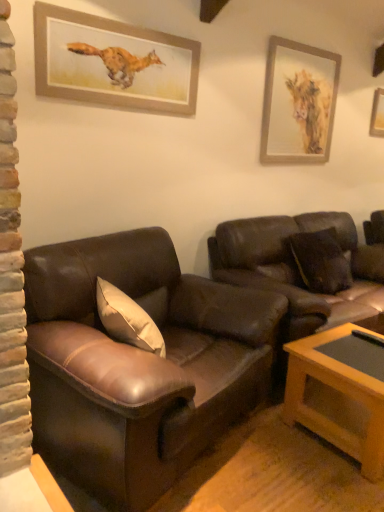
What do you see at coordinates (377, 114) in the screenshot? The height and width of the screenshot is (512, 384). I see `wooden picture frame at upper right, the 3th picture frame in the left-to-right sequence` at bounding box center [377, 114].

This screenshot has width=384, height=512. Find the location of `matte gold picture frame at upper right, which is the 2th picture frame from front to back`. matte gold picture frame at upper right, which is the 2th picture frame from front to back is located at coordinates (298, 102).

The height and width of the screenshot is (512, 384). What do you see at coordinates (340, 393) in the screenshot?
I see `wooden coffee table at lower right` at bounding box center [340, 393].

You are a GUI agent. You are given a task and a screenshot of the screen. Output one action in this format:
    pyautogui.click(x=<x>, y=<y>)
    Task: Click on the brown leather couch at left, which is the first studio couch in left-to-right order
    This screenshot has height=512, width=384.
    Given the screenshot: What is the action you would take?
    pyautogui.click(x=139, y=364)

Where is `brown leather couch at center, the first studio couch viewed from the right`? Image resolution: width=384 pixels, height=512 pixels. brown leather couch at center, the first studio couch viewed from the right is located at coordinates (297, 269).

Which of these two, wooden picture frame at upper right, the 3th picture frame in the left-to-right sequence, or matte gold picture frame at upper right, positioned as the second picture frame in right-to-left order, stands taller?

Standing taller between the two is matte gold picture frame at upper right, positioned as the second picture frame in right-to-left order.

Is matte gold picture frame at upper right, positioned as the second picture frame in right-to-left order, at the back of wooden picture frame at upper right, the 3th picture frame in the left-to-right sequence?

No.

Relative to matte gold picture frame at upper right, positioned as the second picture frame in right-to-left order, is wooden picture frame at upper right, the 3th picture frame in the left-to-right sequence, in front or behind?

In the image, wooden picture frame at upper right, the 3th picture frame in the left-to-right sequence, appears behind matte gold picture frame at upper right, positioned as the second picture frame in right-to-left order.

How much distance is there between wooden picture frame at upper right, which is the 1th picture frame from right to left, and matte gold picture frame at upper right, the 2th picture frame from the left?

The distance of wooden picture frame at upper right, which is the 1th picture frame from right to left, from matte gold picture frame at upper right, the 2th picture frame from the left, is 3.63 feet.

Can you see wooden picture frame at upper right, which appears as the third picture frame when viewed from the front, touching brown leather couch at center, acting as the second studio couch starting from the left?

No, wooden picture frame at upper right, which appears as the third picture frame when viewed from the front, is not making contact with brown leather couch at center, acting as the second studio couch starting from the left.

Is wooden picture frame at upper right, the 3th picture frame in the left-to-right sequence, inside or outside of brown leather couch at center, the first studio couch viewed from the right?

wooden picture frame at upper right, the 3th picture frame in the left-to-right sequence, exists outside the volume of brown leather couch at center, the first studio couch viewed from the right.

From the image's perspective, does wooden picture frame at upper right, which appears as the third picture frame when viewed from the front, appear lower than brown leather couch at center, the first studio couch viewed from the right?

Incorrect, from the image's perspective, wooden picture frame at upper right, which appears as the third picture frame when viewed from the front, is higher than brown leather couch at center, the first studio couch viewed from the right.

Considering the positions of objects matte gold picture frame at upper right, positioned as the 2th picture frame in back-to-front order, and brown leather couch at center, the first studio couch viewed from the right, in the image provided, who is more to the right, matte gold picture frame at upper right, positioned as the 2th picture frame in back-to-front order, or brown leather couch at center, the first studio couch viewed from the right,?

brown leather couch at center, the first studio couch viewed from the right.

From a real-world perspective, is matte gold picture frame at upper right, positioned as the second picture frame in right-to-left order, on brown leather couch at center, acting as the second studio couch starting from the left?

Indeed, from a real-world perspective, matte gold picture frame at upper right, positioned as the second picture frame in right-to-left order, stands above brown leather couch at center, acting as the second studio couch starting from the left.

Is point (278, 113) farther from viewer compared to point (342, 295)?

Yes, point (278, 113) is behind point (342, 295).

From the image's perspective, between matte gold picture frame at upper right, the 2th picture frame from the left, and brown leather couch at center, acting as the second studio couch starting from the left, who is located below?

brown leather couch at center, acting as the second studio couch starting from the left, from the image's perspective.

Considering the relative sizes of brown leather couch at center, the first studio couch viewed from the right, and wooden picture frame at upper right, the 3th picture frame in the left-to-right sequence, in the image provided, is brown leather couch at center, the first studio couch viewed from the right, shorter than wooden picture frame at upper right, the 3th picture frame in the left-to-right sequence,?

Incorrect, the height of brown leather couch at center, the first studio couch viewed from the right, does not fall short of that of wooden picture frame at upper right, the 3th picture frame in the left-to-right sequence.

Considering the sizes of objects brown leather couch at center, the first studio couch viewed from the right, and wooden picture frame at upper right, the 3th picture frame in the left-to-right sequence, in the image provided, who is bigger, brown leather couch at center, the first studio couch viewed from the right, or wooden picture frame at upper right, the 3th picture frame in the left-to-right sequence,?

brown leather couch at center, the first studio couch viewed from the right.

Is brown leather couch at center, the first studio couch viewed from the right, located outside wooden picture frame at upper right, the 3th picture frame in the left-to-right sequence?

brown leather couch at center, the first studio couch viewed from the right, is positioned outside wooden picture frame at upper right, the 3th picture frame in the left-to-right sequence.

Is brown leather couch at left, arranged as the second studio couch when viewed from the right, surrounded by matte gold picture frame at upper right, the 2th picture frame from the left?

No, brown leather couch at left, arranged as the second studio couch when viewed from the right, is not a part of matte gold picture frame at upper right, the 2th picture frame from the left.

Does point (315, 152) come behind point (54, 410)?

Yes, point (315, 152) is behind point (54, 410).

Can you tell me how much matte gold picture frame at upper right, which is the 2th picture frame from front to back, and brown leather couch at left, arranged as the second studio couch when viewed from the right, differ in facing direction?

15.5 degrees separate the facing orientations of matte gold picture frame at upper right, which is the 2th picture frame from front to back, and brown leather couch at left, arranged as the second studio couch when viewed from the right.

Looking at their sizes, would you say matte gold picture frame at upper right, positioned as the 2th picture frame in back-to-front order, is wider or thinner than brown leather couch at left, which is the first studio couch in left-to-right order?

In the image, matte gold picture frame at upper right, positioned as the 2th picture frame in back-to-front order, appears to be more narrow than brown leather couch at left, which is the first studio couch in left-to-right order.

Between matte gold picture frame at upper right, positioned as the second picture frame in right-to-left order, and wooden picture frame at upper left, acting as the first picture frame starting from the left, which one is positioned behind?

matte gold picture frame at upper right, positioned as the second picture frame in right-to-left order, is further away from the camera.

At what (x,y) coordinates should I click in order to perform the action: click on picture frame that is the 1st one when counting upward from the wooden picture frame at upper left, acting as the first picture frame starting from the left (from the image's perspective). Please return your answer as a coordinate pair (x, y). This screenshot has height=512, width=384. Looking at the image, I should click on (298, 102).

Is matte gold picture frame at upper right, positioned as the second picture frame in right-to-left order, oriented away from wooden picture frame at upper left, which ranks as the 1th picture frame in front-to-back order?

No, wooden picture frame at upper left, which ranks as the 1th picture frame in front-to-back order, is not at the back of matte gold picture frame at upper right, positioned as the second picture frame in right-to-left order.

Is there a large distance between matte gold picture frame at upper right, the 2th picture frame from the left, and wooden picture frame at upper left, the 3th picture frame in the right-to-left sequence?

Yes.

Could matte gold picture frame at upper right, the 2th picture frame from the left, be considered to be inside brown leather couch at center, the first studio couch viewed from the right?

No, matte gold picture frame at upper right, the 2th picture frame from the left, is not surrounded by brown leather couch at center, the first studio couch viewed from the right.

Which object is positioned more to the left, brown leather couch at center, acting as the second studio couch starting from the left, or matte gold picture frame at upper right, which is the 2th picture frame from front to back?

matte gold picture frame at upper right, which is the 2th picture frame from front to back.

How many degrees apart are the facing directions of brown leather couch at center, acting as the second studio couch starting from the left, and matte gold picture frame at upper right, which is the 2th picture frame from front to back?

The angle between the facing direction of brown leather couch at center, acting as the second studio couch starting from the left, and the facing direction of matte gold picture frame at upper right, which is the 2th picture frame from front to back, is 0.00284 degrees.

From a real-world perspective, is brown leather couch at center, acting as the second studio couch starting from the left, below matte gold picture frame at upper right, positioned as the second picture frame in right-to-left order?

Yes, from a real-world perspective, brown leather couch at center, acting as the second studio couch starting from the left, is beneath matte gold picture frame at upper right, positioned as the second picture frame in right-to-left order.

This screenshot has height=512, width=384. In order to click on picture frame on the right of the matte gold picture frame at upper right, the 2th picture frame from the left in this screenshot , I will do `click(377, 114)`.

Identify the location of picture frame that is the 2nd one when counting backward from the brown leather couch at center, the first studio couch viewed from the right. The height and width of the screenshot is (512, 384). (377, 114).

Estimate the real-world distances between objects in this image. Which object is further from wooden picture frame at upper right, the 3th picture frame in the left-to-right sequence, wooden coffee table at lower right or brown leather couch at left, which is the first studio couch in left-to-right order?

brown leather couch at left, which is the first studio couch in left-to-right order, lies further to wooden picture frame at upper right, the 3th picture frame in the left-to-right sequence, than the other object.

Based on their spatial positions, is wooden picture frame at upper left, the third picture frame in the back-to-front sequence, or brown leather couch at center, acting as the second studio couch starting from the left, further from wooden picture frame at upper right, which is counted as the first picture frame, starting from the back?

The object further to wooden picture frame at upper right, which is counted as the first picture frame, starting from the back, is wooden picture frame at upper left, the third picture frame in the back-to-front sequence.

Looking at the image, which one is located closer to brown leather couch at left, which is the first studio couch in left-to-right order, wooden picture frame at upper right, which is the 1th picture frame from right to left, or wooden coffee table at lower right?

The object closer to brown leather couch at left, which is the first studio couch in left-to-right order, is wooden coffee table at lower right.

Estimate the real-world distances between objects in this image. Which object is further from matte gold picture frame at upper right, which is the 2th picture frame from front to back, wooden picture frame at upper right, which is counted as the first picture frame, starting from the back, or brown leather couch at center, acting as the second studio couch starting from the left?

wooden picture frame at upper right, which is counted as the first picture frame, starting from the back.

Which object lies further to the anchor point wooden picture frame at upper left, the third picture frame in the back-to-front sequence, brown leather couch at center, acting as the second studio couch starting from the left, or brown leather couch at left, arranged as the second studio couch when viewed from the right?

The object further to wooden picture frame at upper left, the third picture frame in the back-to-front sequence, is brown leather couch at center, acting as the second studio couch starting from the left.

Considering their positions, is brown leather couch at center, acting as the second studio couch starting from the left, positioned closer to wooden coffee table at lower right than matte gold picture frame at upper right, positioned as the 2th picture frame in back-to-front order?

Among the two, brown leather couch at center, acting as the second studio couch starting from the left, is located nearer to wooden coffee table at lower right.

When comparing their distances from wooden picture frame at upper left, acting as the first picture frame starting from the left, does wooden picture frame at upper right, which is counted as the first picture frame, starting from the back, or wooden coffee table at lower right seem further?

Among the two, wooden picture frame at upper right, which is counted as the first picture frame, starting from the back, is located further to wooden picture frame at upper left, acting as the first picture frame starting from the left.

Estimate the real-world distances between objects in this image. Which object is closer to matte gold picture frame at upper right, the 2th picture frame from the left, brown leather couch at left, arranged as the second studio couch when viewed from the right, or wooden picture frame at upper left, the third picture frame in the back-to-front sequence?

The object closer to matte gold picture frame at upper right, the 2th picture frame from the left, is wooden picture frame at upper left, the third picture frame in the back-to-front sequence.

The height and width of the screenshot is (512, 384). I want to click on picture frame between brown leather couch at center, acting as the second studio couch starting from the left, and wooden picture frame at upper right, which appears as the third picture frame when viewed from the front, in the front-back direction, so click(x=298, y=102).

Where is `picture frame between matte gold picture frame at upper right, positioned as the 2th picture frame in back-to-front order, and brown leather couch at center, acting as the second studio couch starting from the left, vertically`? picture frame between matte gold picture frame at upper right, positioned as the 2th picture frame in back-to-front order, and brown leather couch at center, acting as the second studio couch starting from the left, vertically is located at coordinates (113, 62).

I want to click on table situated between brown leather couch at left, which is the first studio couch in left-to-right order, and brown leather couch at center, acting as the second studio couch starting from the left, from left to right, so click(340, 393).

This screenshot has width=384, height=512. Find the location of `table between brown leather couch at left, which is the first studio couch in left-to-right order, and wooden picture frame at upper right, the 3th picture frame in the left-to-right sequence, in the front-back direction`. table between brown leather couch at left, which is the first studio couch in left-to-right order, and wooden picture frame at upper right, the 3th picture frame in the left-to-right sequence, in the front-back direction is located at coordinates (340, 393).